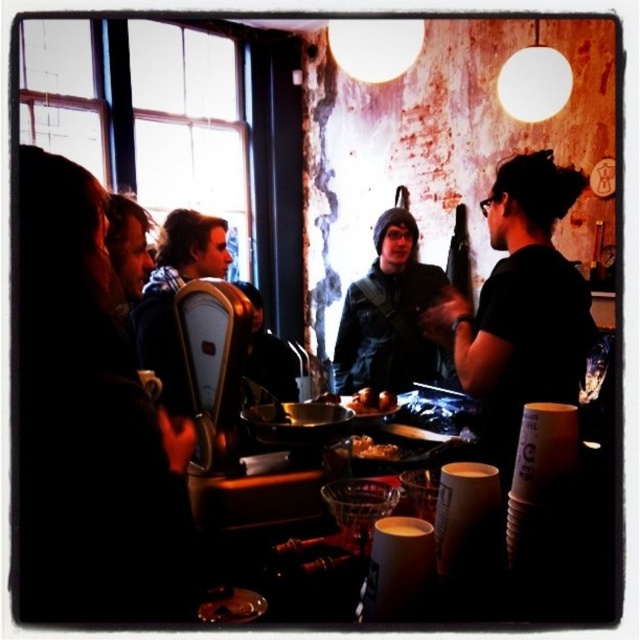
The height and width of the screenshot is (640, 640). What are the coordinates of `black matte shirt at center` in the screenshot? It's located at click(x=520, y=307).

Who is more forward, [564,390] or [392,396]?

Point [564,390]

Looking at this image, who is more distant from viewer, (x=545, y=365) or (x=376, y=406)?

Positioned behind is point (x=545, y=365).

Image resolution: width=640 pixels, height=640 pixels. I want to click on black matte shirt at center, so click(x=520, y=307).

Looking at this image, does black matte shirt at center appear on the left side of denim jacket at center?

In fact, black matte shirt at center is to the right of denim jacket at center.

Is black matte shirt at center positioned at the back of denim jacket at center?

No.

Based on the photo, measure the distance between point [516,394] and camera.

A distance of 5.69 feet exists between point [516,394] and camera.

What are the coordinates of `black matte shirt at center` in the screenshot? It's located at (520, 307).

Is denim jacket at center positioned at the back of shiny golden nuggets at center?

That is True.

Is point (426, 266) closer to camera compared to point (369, 406)?

No, (426, 266) is further to viewer.

Image resolution: width=640 pixels, height=640 pixels. Identify the location of denim jacket at center. (388, 314).

Identify the location of denim jacket at center. This screenshot has width=640, height=640. (388, 314).